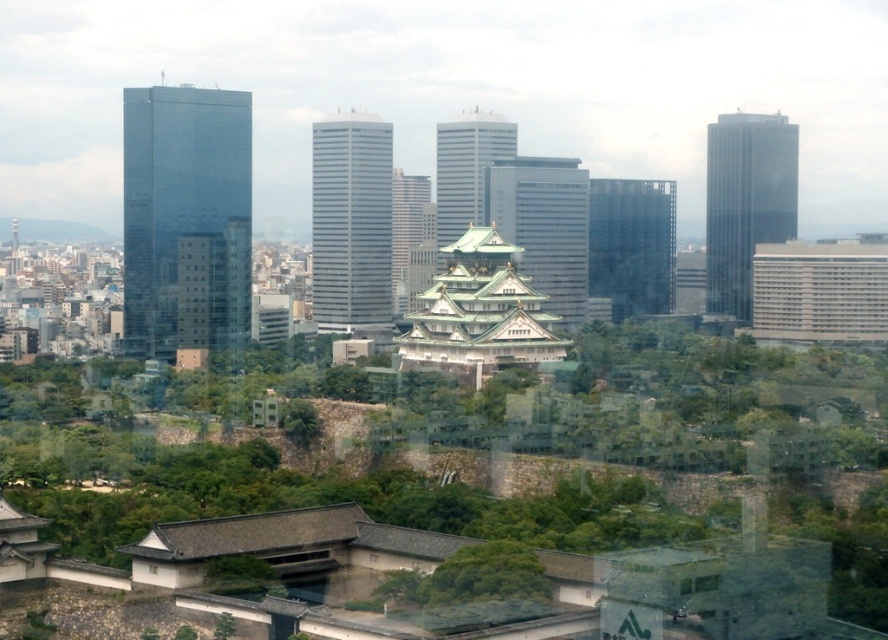
Does glassy reflective skyscraper at center have a larger size compared to smooth glass skyscraper at center?

Yes, glassy reflective skyscraper at center is bigger than smooth glass skyscraper at center.

Can you confirm if glassy reflective skyscraper at center is taller than smooth glass skyscraper at center?

Correct, glassy reflective skyscraper at center is much taller as smooth glass skyscraper at center.

Who is more distant from viewer, (500, 209) or (476, 113)?

Point (476, 113)

You are a GUI agent. You are given a task and a screenshot of the screen. Output one action in this format:
    pyautogui.click(x=<x>, y=<y>)
    Task: Click on the glassy reflective skyscraper at center
    Image resolution: width=888 pixels, height=640 pixels.
    Given the screenshot: What is the action you would take?
    pyautogui.click(x=544, y=225)

Locate an element on the screen. The image size is (888, 640). glassy reflective skyscraper at center is located at coordinates (544, 225).

Between glassy reflective skyscraper at center and dark glass skyscraper at center, which one is positioned lower?

dark glass skyscraper at center is lower down.

Which is in front, point (485, 180) or point (609, 186)?

Positioned in front is point (485, 180).

Identify the location of glassy reflective skyscraper at center. The height and width of the screenshot is (640, 888). (544, 225).

Looking at this image, between green leafy tree at center and smooth glass skyscraper at center, which one has less height?

smooth glass skyscraper at center

Which is below, green leafy tree at center or smooth glass skyscraper at center?

green leafy tree at center is below.

The width and height of the screenshot is (888, 640). Describe the element at coordinates (484, 449) in the screenshot. I see `green leafy tree at center` at that location.

I want to click on green leafy tree at center, so click(484, 449).